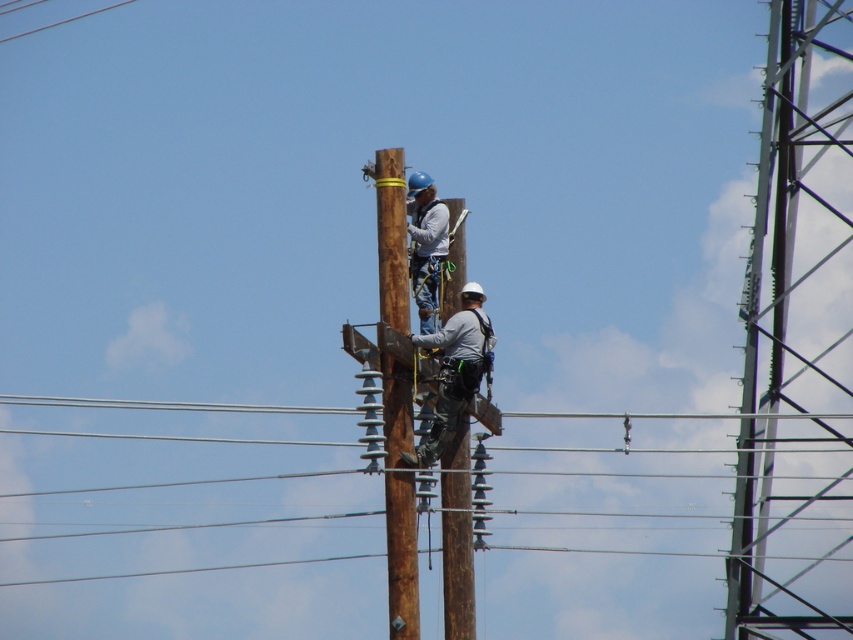
Find the location of a particular element. This screenshot has height=640, width=853. matte gray jacket at center is located at coordinates (426, 246).

Which is below, matte gray jacket at center or clear blue wire at upper left?

matte gray jacket at center is below.

The width and height of the screenshot is (853, 640). What do you see at coordinates (426, 246) in the screenshot? I see `matte gray jacket at center` at bounding box center [426, 246].

This screenshot has width=853, height=640. What are the coordinates of `matte gray jacket at center` in the screenshot? It's located at (426, 246).

Which of these two, metallic gray tower at right or matte gray jacket at center, stands shorter?

With less height is matte gray jacket at center.

Is metallic gray tower at right positioned in front of matte gray jacket at center?

That is False.

Does point (740, 406) come behind point (421, 232)?

Yes, point (740, 406) is behind point (421, 232).

Locate an element on the screen. metallic gray tower at right is located at coordinates (798, 340).

Between point (402, 312) and point (469, 368), which one is positioned behind?

Positioned behind is point (469, 368).

Which is in front, point (407, 289) or point (428, 333)?

Positioned in front is point (407, 289).

Which is in front, point (392, 401) or point (437, 433)?

Point (392, 401) is more forward.

You are a GUI agent. You are given a task and a screenshot of the screen. Output one action in this format:
    pyautogui.click(x=<x>, y=<y>)
    Task: Click on the brown wooden telegraph pole at center
    The image size is (853, 640).
    Given the screenshot: What is the action you would take?
    pyautogui.click(x=392, y=237)